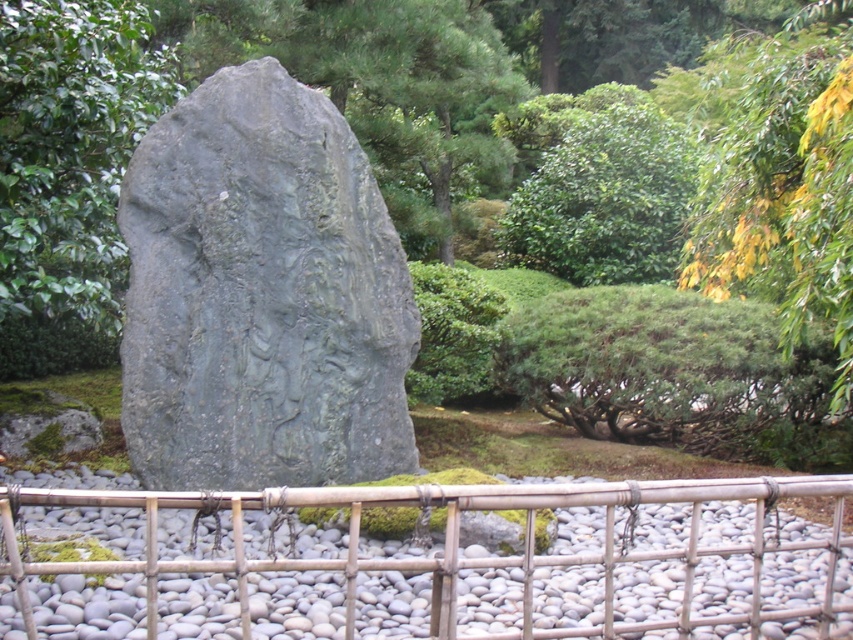
Question: Does green leafy tree at center appear on the right side of green leafy bush at upper center?

Choices:
 (A) no
 (B) yes

Answer: (A)

Question: Is gray stone carving at center bigger than green leafy bush at upper center?

Choices:
 (A) no
 (B) yes

Answer: (A)

Question: Which of the following is the closest to the observer?

Choices:
 (A) (183, 308)
 (B) (618, 180)
 (C) (138, 84)

Answer: (A)

Question: Which of these objects is positioned farthest from the white pebbles at center?

Choices:
 (A) green leafy tree at center
 (B) green leafy bush at upper center

Answer: (B)

Question: Is white pebbles at center below green leafy tree at center?

Choices:
 (A) no
 (B) yes

Answer: (B)

Question: Which object is positioned closest to the gray stone carving at center?

Choices:
 (A) green leafy bush at upper center
 (B) green leafy tree at center
 (C) white pebbles at center

Answer: (B)